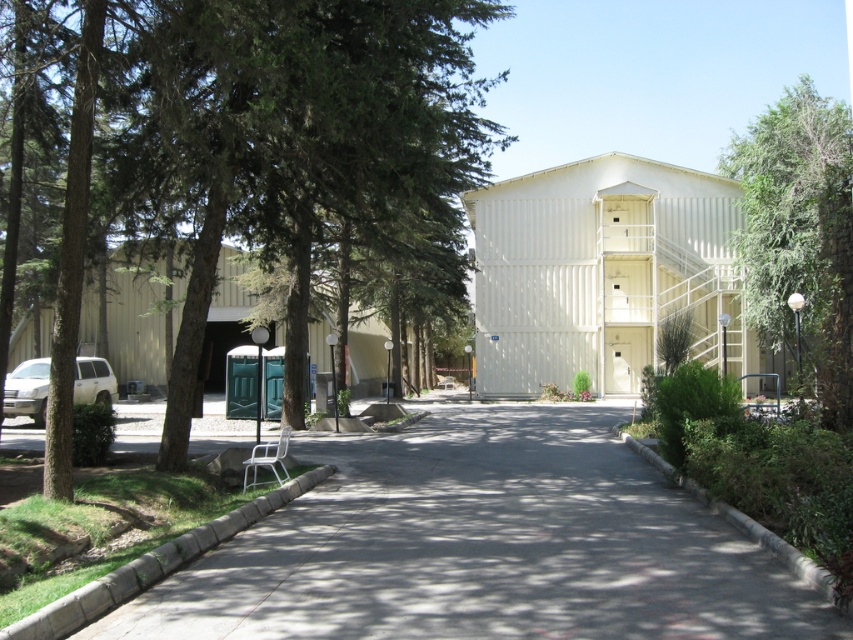
Does gray asphalt pavement at center have a lesser width compared to green leafy tree at upper right?

Correct, gray asphalt pavement at center's width is less than green leafy tree at upper right's.

Which is in front, point (631, 529) or point (804, 241)?

Point (631, 529)

Find the location of `gray asphalt pavement at center`. gray asphalt pavement at center is located at coordinates (483, 545).

Does green leafy tree at upper right appear over matte white suv at left?

Indeed, green leafy tree at upper right is positioned over matte white suv at left.

At what (x,y) coordinates should I click in order to perform the action: click on green leafy tree at upper right. Please return your answer as a coordinate pair (x, y). The height and width of the screenshot is (640, 853). Looking at the image, I should click on (799, 234).

Between point (827, 180) and point (42, 404), which one is positioned in front?

Point (42, 404)

Locate an element on the screen. The height and width of the screenshot is (640, 853). green leafy tree at upper right is located at coordinates (799, 234).

Is point (183, 189) behind point (28, 401)?

No, it is not.

Between green leafy tree at center and matte white suv at left, which one appears on the right side from the viewer's perspective?

green leafy tree at center is more to the right.

What do you see at coordinates (294, 136) in the screenshot? I see `green leafy tree at center` at bounding box center [294, 136].

Where is `green leafy tree at center`? This screenshot has height=640, width=853. green leafy tree at center is located at coordinates (294, 136).